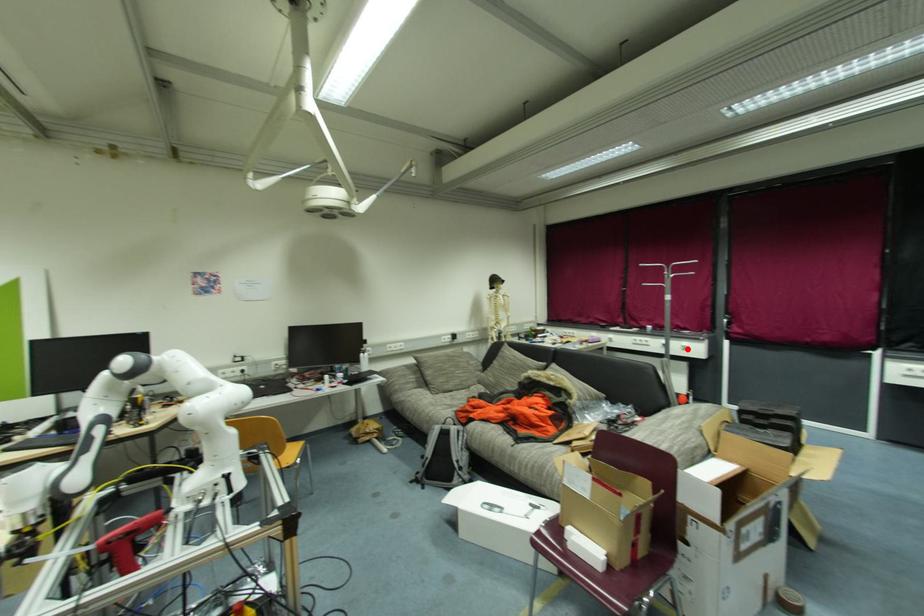
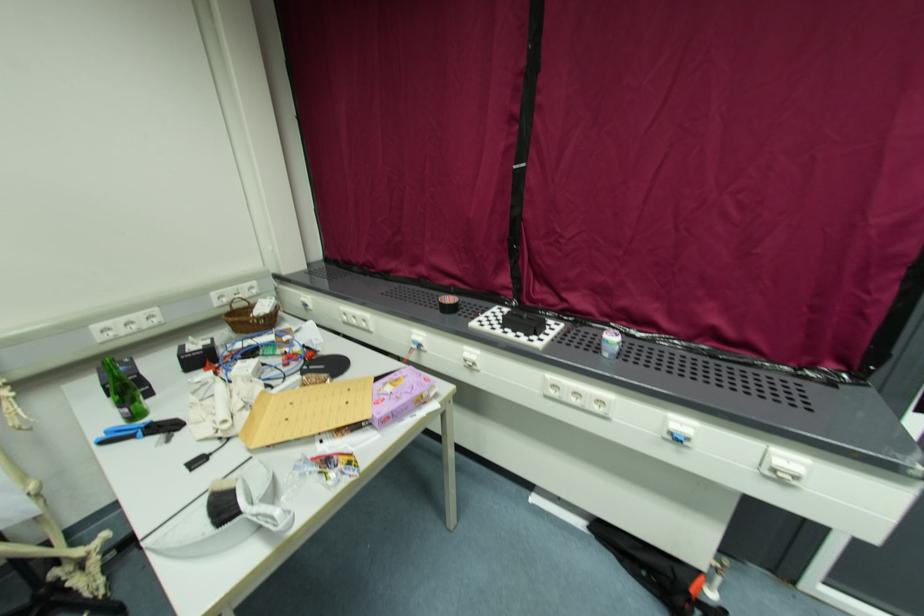
Find the pixel in the second image that matches the highlighted location in the first image.

(783, 477)